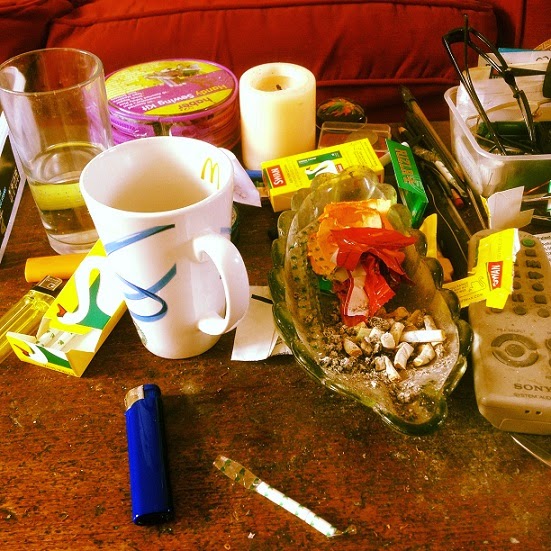
You are a GUI agent. You are given a task and a screenshot of the screen. Output one action in this format:
    pyautogui.click(x=<x>, y=<y>)
    Task: Click on the table
    Image resolution: width=551 pixels, height=551 pixels.
    Given the screenshot: What is the action you would take?
    pyautogui.click(x=291, y=432)